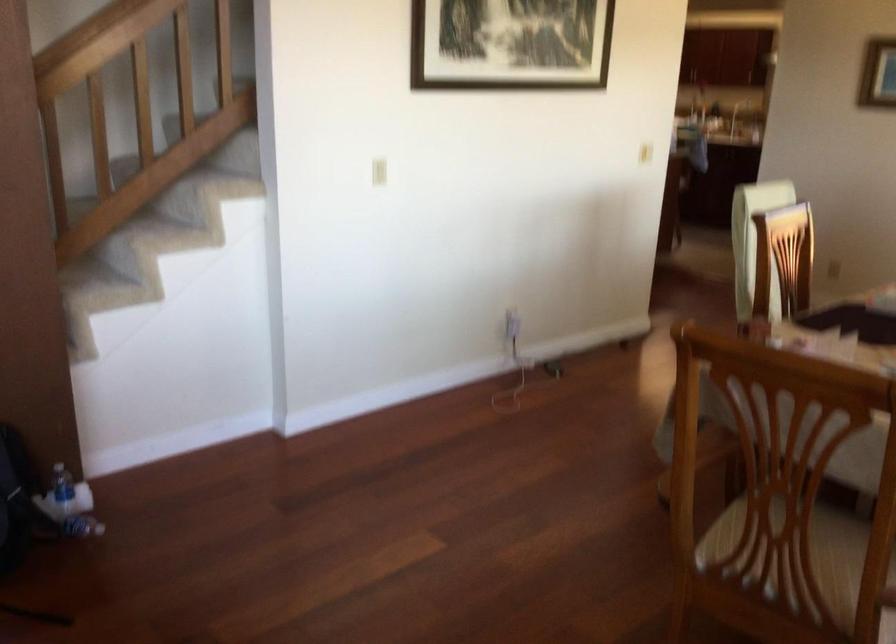
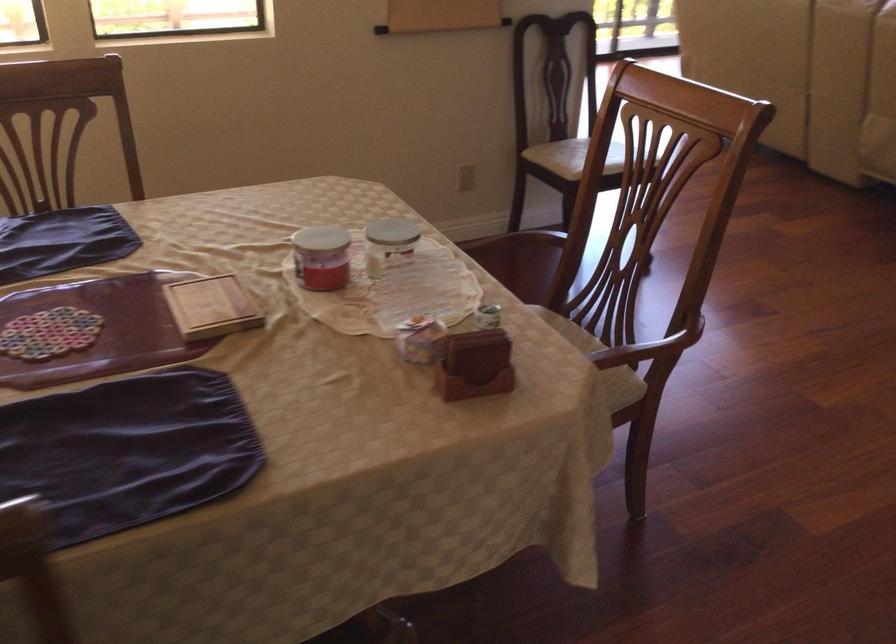
Where in the second image is the point corresponding to (x=806, y=576) from the first image?

(564, 322)